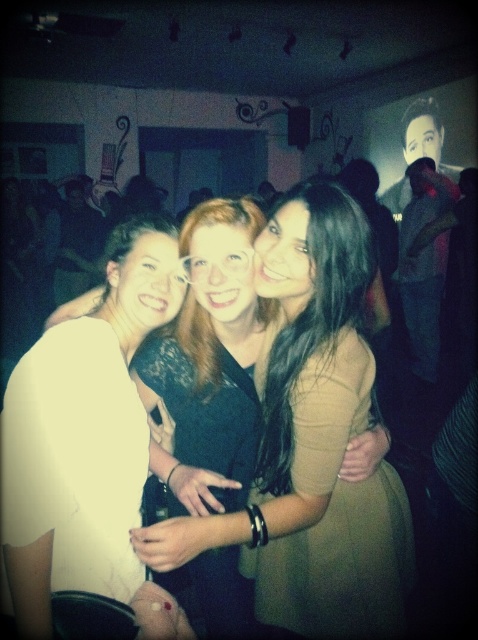
Measure the distance between point [162,321] and camera.

The distance of point [162,321] from camera is 1.15 meters.

Based on the photo, is white matte shirt at center shorter than matte black dress at center?

Yes.

Which is in front, point (74, 481) or point (273, 513)?

Point (74, 481) is more forward.

I want to click on white matte shirt at center, so click(x=84, y=435).